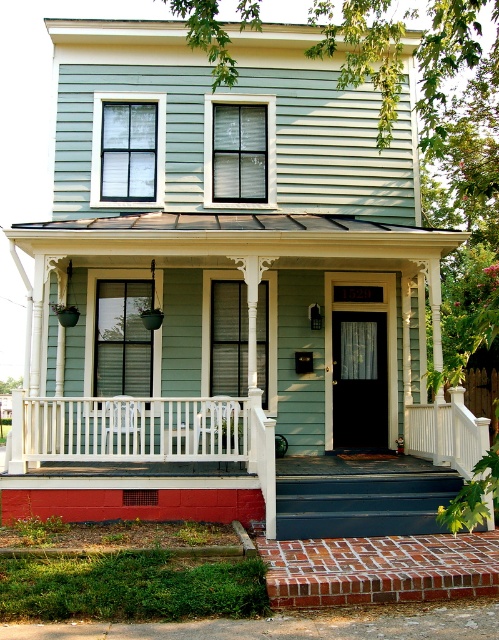
You are standing at the base of the house and want to walk towards the front door. There are two points marked on the image. The first point is at coordinate point (x=235, y=394) and the second is at point (x=109, y=456). Which point should you aim for if you want to reach the front door first?

Point (x=235, y=394) is behind point (x=109, y=456), so you should aim for point (x=109, y=456) first as it is closer to your current position at the base of the house.

You are standing on the front porch of the house and want to place a decorative planter between the smooth white railing at center and the white painted wood railing at center. Which railing should you place the planter closer to in order to have it appear larger in the view from the front yard?

The smooth white railing at center is closer to the viewer than the white painted wood railing at center. To make the planter appear larger in the view from the front yard, place it closer to the smooth white railing at center since objects closer to the viewer appear larger.